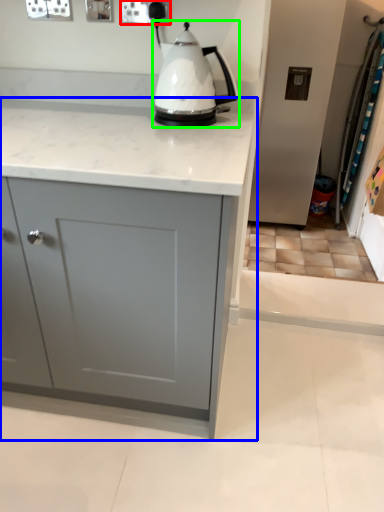
Question: Considering the real-world distances, which object is closest to electric outlet (highlighted by a red box)? cabinetry (highlighted by a blue box) or kettle (highlighted by a green box).

Choices:
 (A) cabinetry
 (B) kettle

Answer: (B)